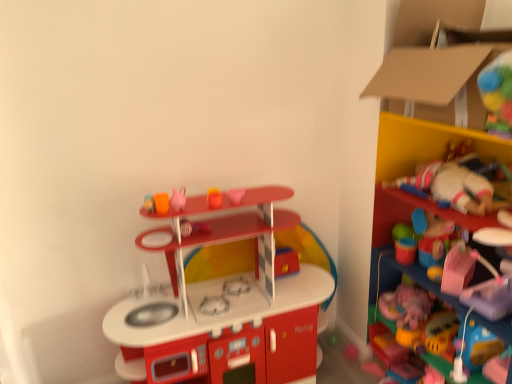
Question: Which direction should I rotate to look at matte plastic cup at center, which ranks as the 4th toy in top-to-bottom order?

Choices:
 (A) left
 (B) right

Answer: (A)

Question: From a real-world perspective, is matte plastic cup at center, which ranks as the 4th toy in top-to-bottom order, located higher than smooth plastic cup at upper center, which is the 4th toy in bottom-to-top order?

Choices:
 (A) no
 (B) yes

Answer: (A)

Question: From the image's perspective, is matte plastic cup at center, the third toy from the bottom, under smooth plastic cup at upper center, marked as the third toy in a top-to-bottom arrangement?

Choices:
 (A) no
 (B) yes

Answer: (B)

Question: Is matte plastic cup at center, which ranks as the 4th toy in top-to-bottom order, far away from smooth plastic cup at upper center, which is the 4th toy in bottom-to-top order?

Choices:
 (A) no
 (B) yes

Answer: (A)

Question: Does matte plastic cup at center, which ranks as the 4th toy in top-to-bottom order, contain smooth plastic cup at upper center, which is the 4th toy in bottom-to-top order?

Choices:
 (A) no
 (B) yes

Answer: (A)

Question: Does matte plastic cup at center, the third toy from the bottom, have a smaller size compared to smooth plastic cup at upper center, which is the 4th toy in bottom-to-top order?

Choices:
 (A) no
 (B) yes

Answer: (A)

Question: Is matte plastic cup at center, which ranks as the 4th toy in top-to-bottom order, thinner than smooth plastic cup at upper center, marked as the third toy in a top-to-bottom arrangement?

Choices:
 (A) no
 (B) yes

Answer: (B)

Question: Can we say cardboard at upper right lies outside pink matte heart at upper center, which is the first toy in top-to-bottom order?

Choices:
 (A) no
 (B) yes

Answer: (B)

Question: Are cardboard at upper right and pink matte heart at upper center, which is the first toy in top-to-bottom order, beside each other?

Choices:
 (A) no
 (B) yes

Answer: (A)

Question: Is cardboard at upper right turned away from pink matte heart at upper center, which is the first toy in top-to-bottom order?

Choices:
 (A) no
 (B) yes

Answer: (A)

Question: From the image's perspective, would you say cardboard at upper right is positioned over pink matte heart at upper center, the 6th toy ordered from the bottom?

Choices:
 (A) no
 (B) yes

Answer: (B)

Question: Could you tell me if cardboard at upper right is turned towards pink matte heart at upper center, the 6th toy ordered from the bottom?

Choices:
 (A) no
 (B) yes

Answer: (A)

Question: From a real-world perspective, does cardboard at upper right sit lower than pink matte heart at upper center, the 6th toy ordered from the bottom?

Choices:
 (A) yes
 (B) no

Answer: (B)

Question: From the image's perspective, is cardboard at upper right below matte pink teapot at upper center, arranged as the 2th toy when viewed from the top?

Choices:
 (A) yes
 (B) no

Answer: (B)